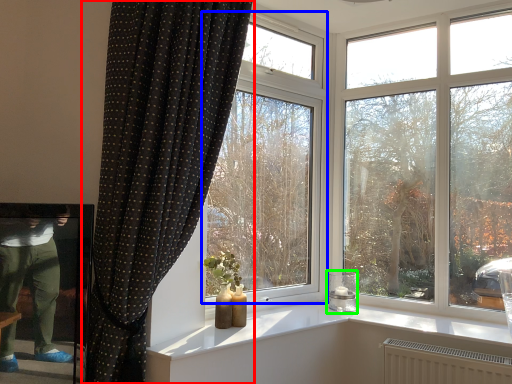
Question: Which object is the closest to the curtain (highlighted by a red box)? Choose among these: window (highlighted by a blue box) or candle holder (highlighted by a green box).

Choices:
 (A) window
 (B) candle holder

Answer: (A)